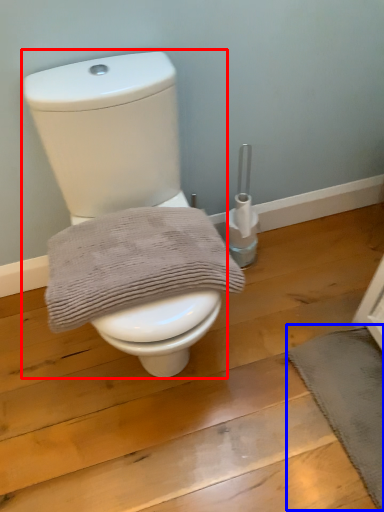
Question: Which of the following is the closest to the observer, toilet (highlighted by a red box) or bath mat (highlighted by a blue box)?

Choices:
 (A) toilet
 (B) bath mat

Answer: (A)